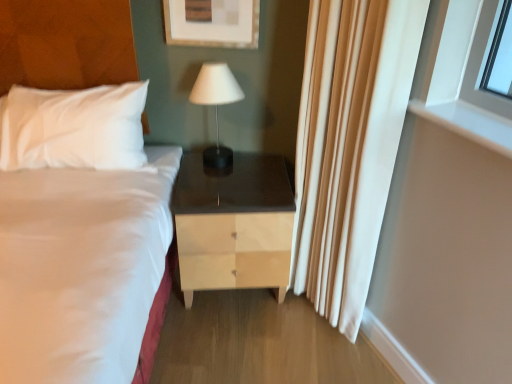
You are a GUI agent. You are given a task and a screenshot of the screen. Output one action in this format:
    pyautogui.click(x=<x>, y=<y>)
    Task: Click on the free space to the left of white matte table lamp at center
    
    Given the screenshot: What is the action you would take?
    pyautogui.click(x=182, y=158)